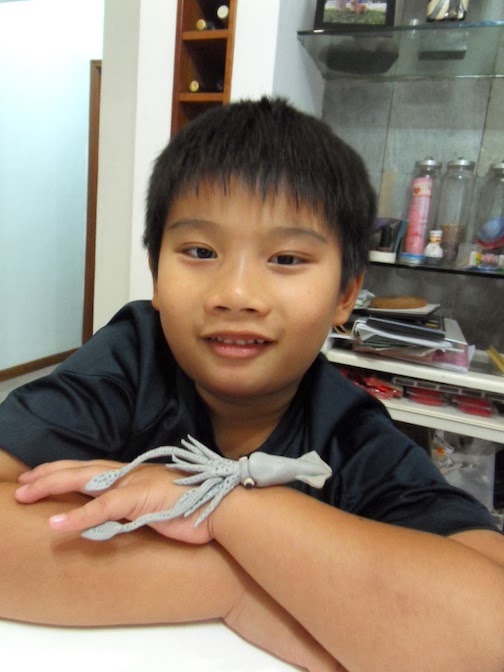
The height and width of the screenshot is (672, 504). In order to click on messy stack of papers and books right of center in this screenshot , I will do `click(420, 341)`, `click(408, 322)`.